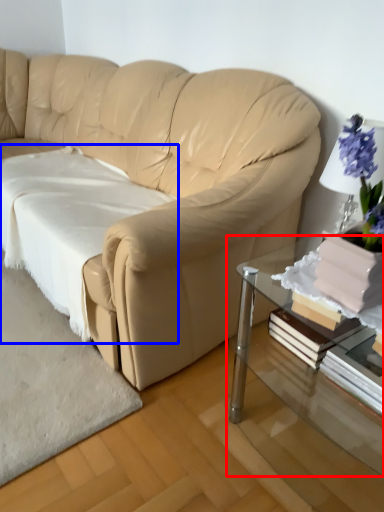
Question: Which object appears farthest to the camera in this image, table (highlighted by a red box) or sheet (highlighted by a blue box)?

Choices:
 (A) table
 (B) sheet

Answer: (B)